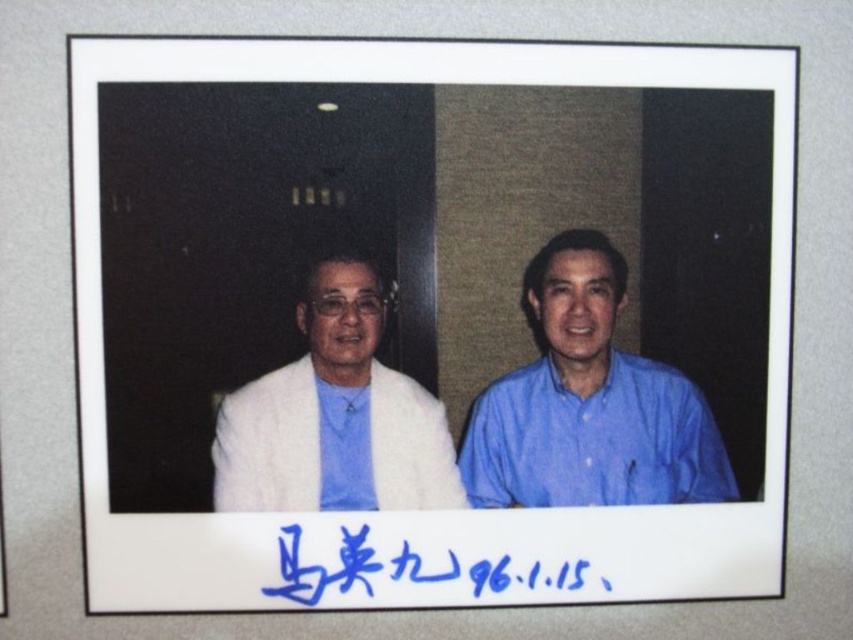
You are organizing a fashion show and need to place the white fur coat at left on a mannequin. The mannequin is positioned at coordinates point A. If the coat is currently at point B, which is at coordinates point B, can you determine the direction you need to move the coat to reach the mannequin?

The white fur coat at left is located at point B, which is at coordinates point B. To move it to the mannequin at point A, you would need to move it in the direction from point B to point A. However, without specific coordinates for point A, the exact direction cannot be determined.

In the Polaroid photo, there is a point labeled at coordinates (334, 417). Which object in the image does this point correspond to?

The point at coordinates (334, 417) corresponds to the white fur coat at left.

From the picture: You are designing a layout for a photo album and want to ensure the blue cotton shirt at right and the blue handwritten text at lower center are both visible. Based on their positions in the original photo, which object is closer to the viewer?

The blue cotton shirt at right is closer to the viewer than the blue handwritten text at lower center because it is positioned in front of it.